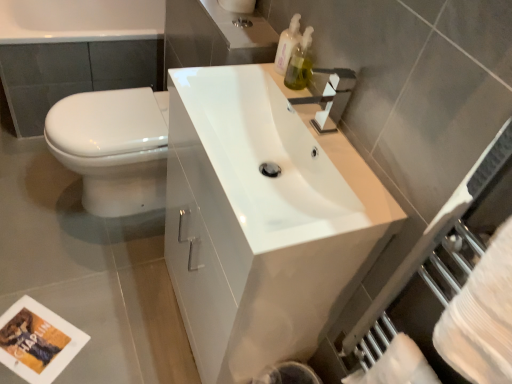
You are a GUI agent. You are given a task and a screenshot of the screen. Output one action in this format:
    pyautogui.click(x=<x>, y=<y>)
    Task: Click on the vacant area on top of white glossy toilet at left (from a real-world perspective)
    This screenshot has height=384, width=512.
    Given the screenshot: What is the action you would take?
    pyautogui.click(x=115, y=109)